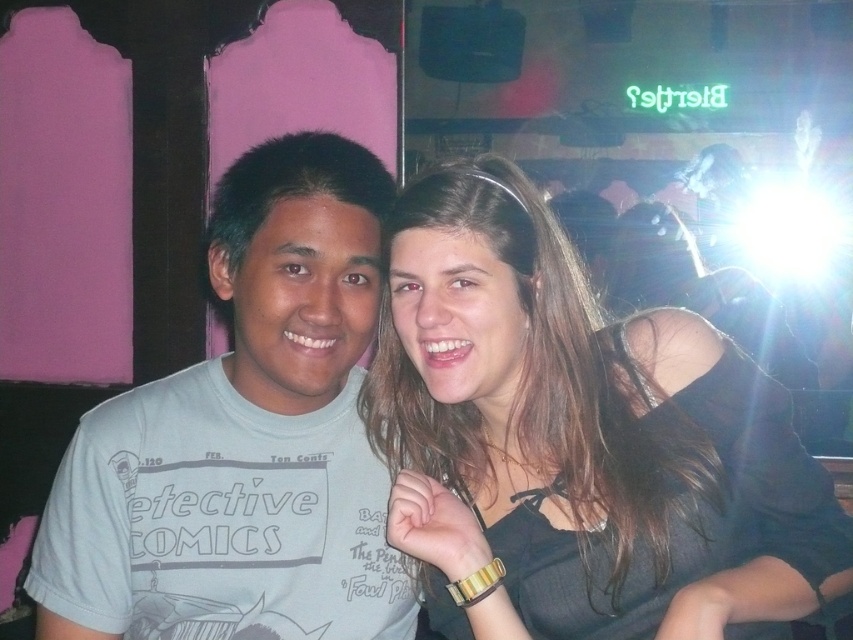
Is dark brown hair at center shorter than light gray cotton t-shirt at center?

Yes, dark brown hair at center is shorter than light gray cotton t-shirt at center.

Between point (665, 353) and point (247, 616), which one is positioned behind?

The point (247, 616) is behind.

Image resolution: width=853 pixels, height=640 pixels. I want to click on dark brown hair at center, so click(x=579, y=440).